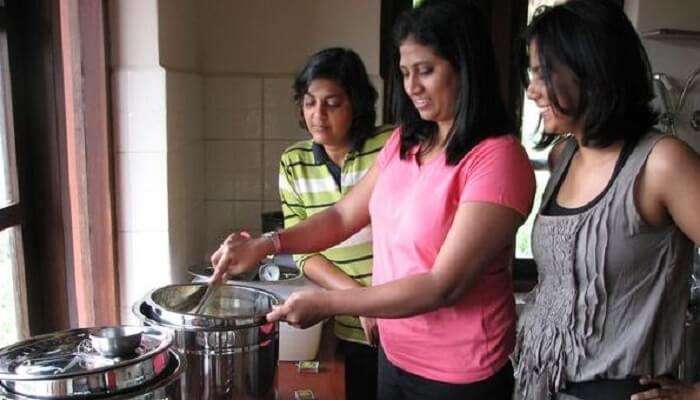
Where is `spoon handle`? spoon handle is located at coordinates tap(206, 295).